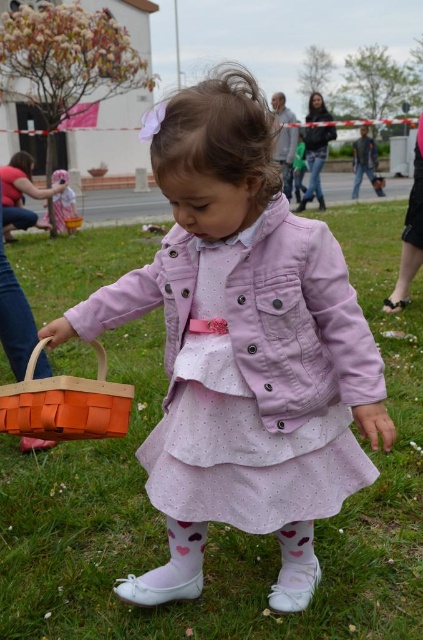
You are organizing a small picnic and need to place both the green grass at center and the matte pink jacket at center on a table. Which object should you place first if you want to ensure there is enough space for both?

The green grass at center has a smaller size compared to the matte pink jacket at center, so you should place the matte pink jacket at center first to ensure there is enough space for both.

You are a photographer standing at the edge of the grassy area. You want to take a photo of the green grass at center and the matte pink jacket at center so that both are in focus. The camera you are using has a depth of field that can cover 2 meters. Will both subjects be in focus?

The green grass at center and the matte pink jacket at center are 1.83 meters apart. Since the camera can cover 2 meters, both subjects will be in focus.